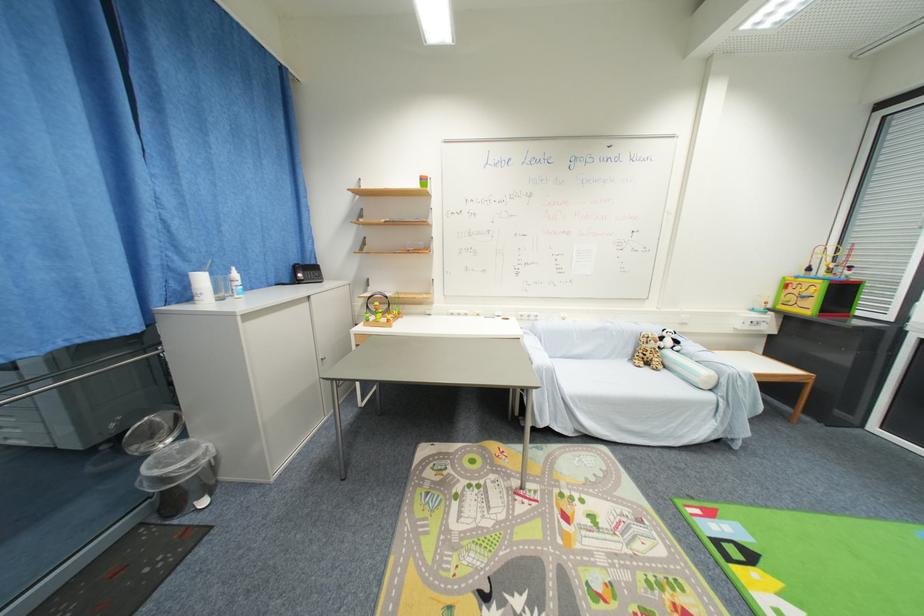
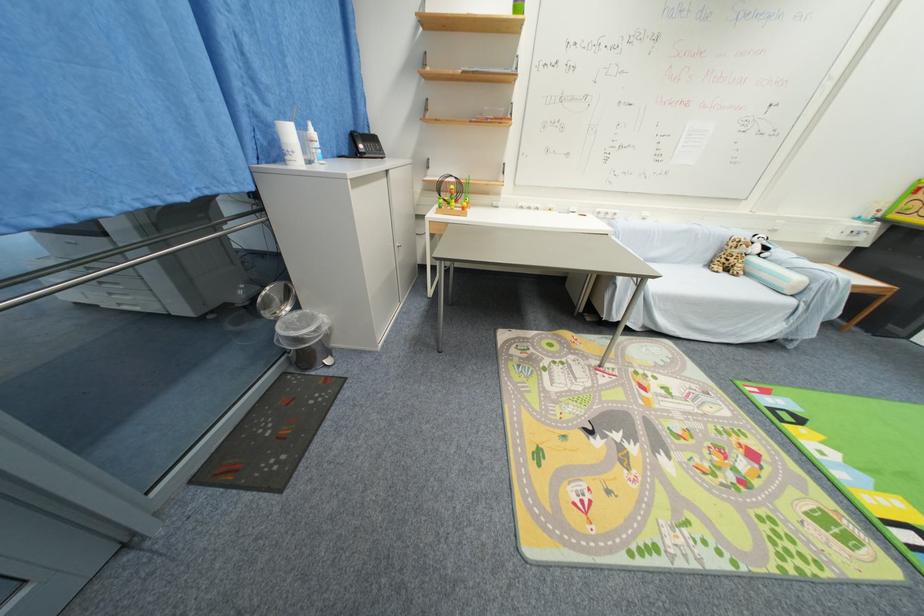
Where in the second image is the point corresponding to the point at 142,450 from the first image?

(271, 315)